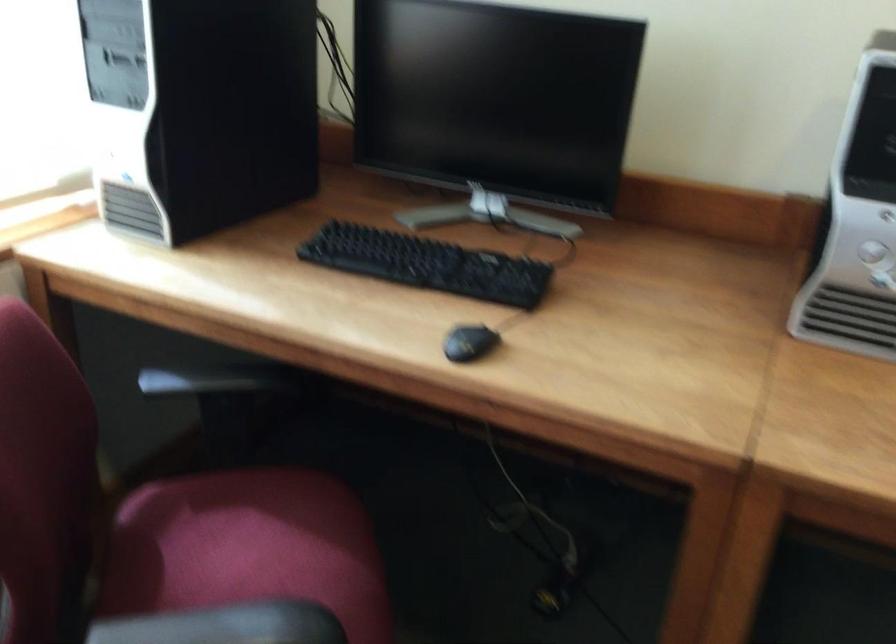
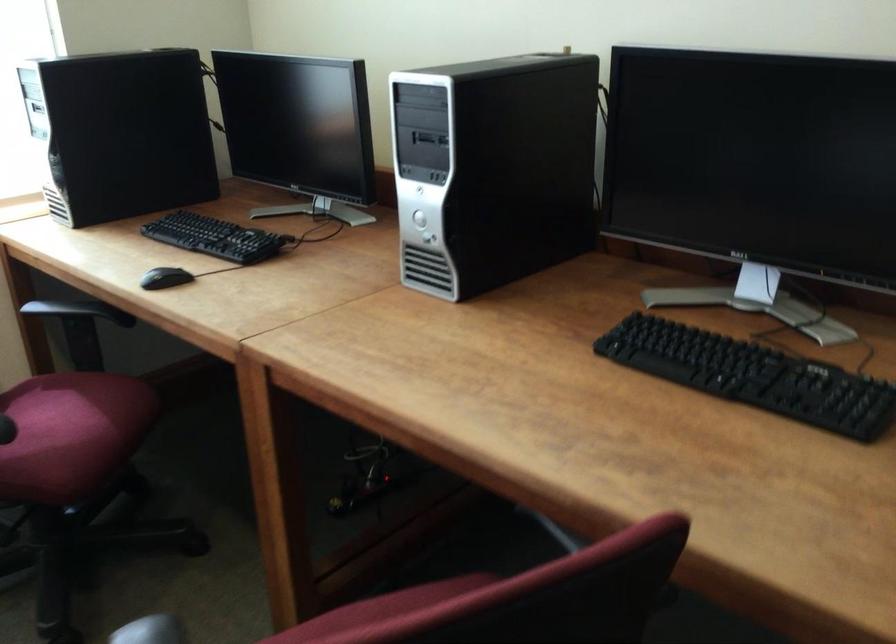
Find the pixel in the second image that matches pixel 239 384 in the first image.

(74, 310)